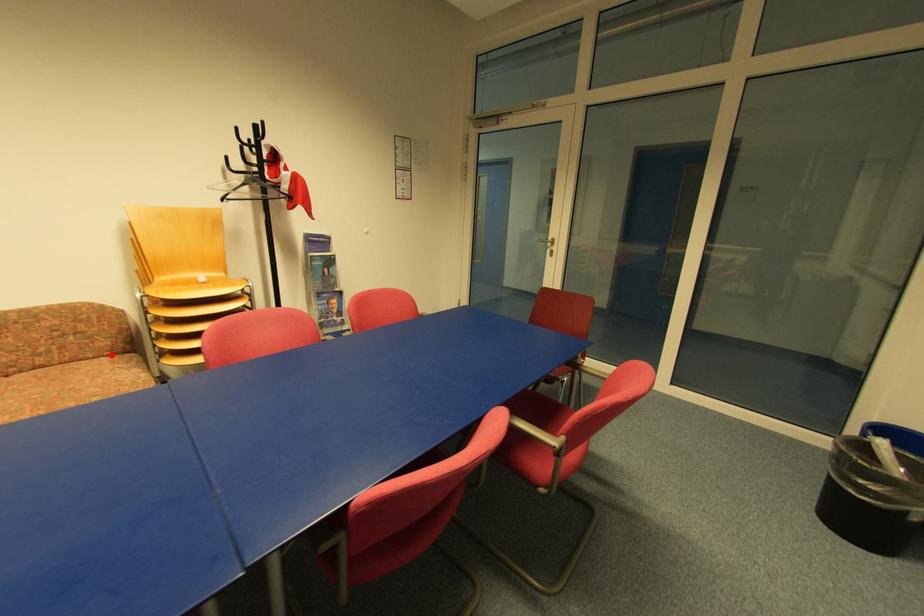
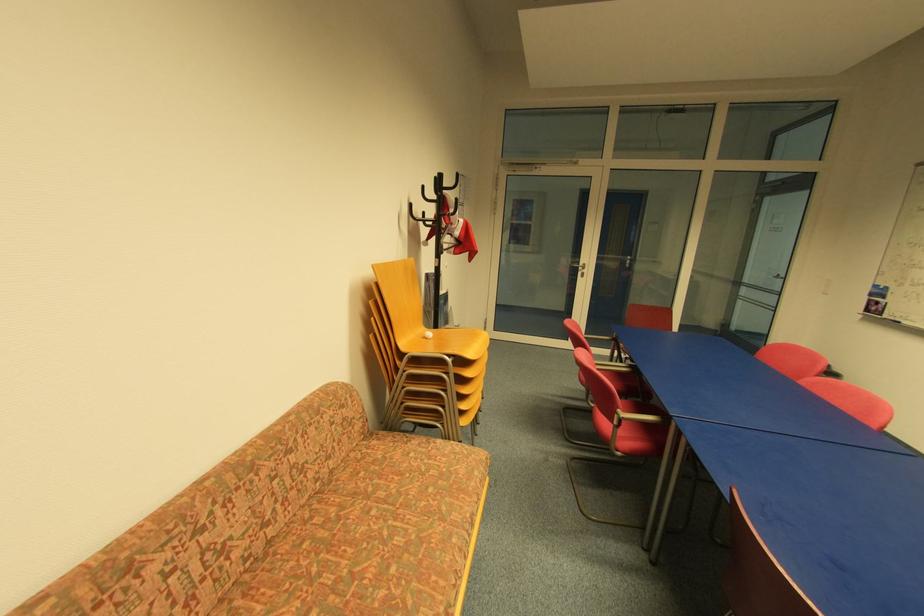
In the second image, find the point that corresponds to the highlighted location in the first image.

(367, 438)